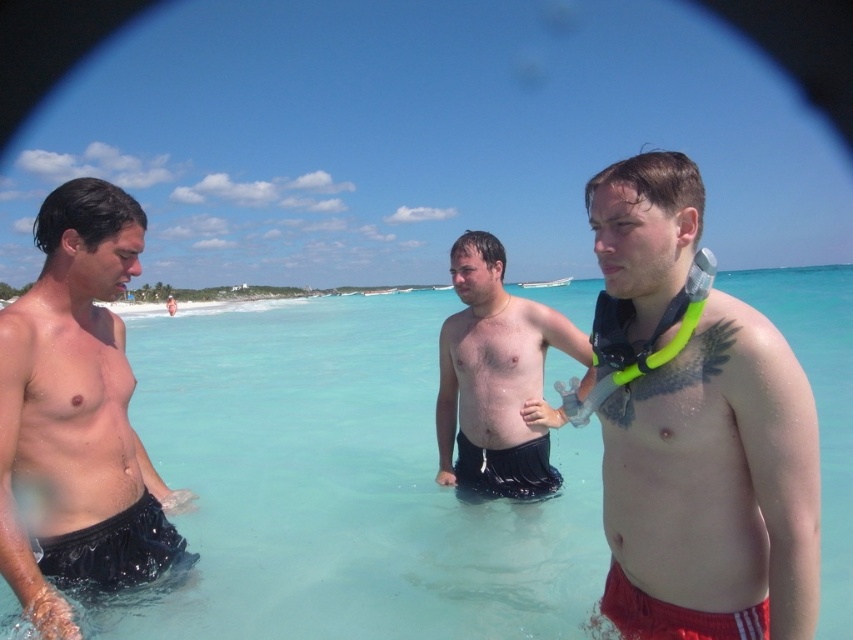
You are a photographer trying to capture a photo of the shiny black shorts at left and the black mesh shorts at lower left. Which one is positioned higher in the image?

The shiny black shorts at left is located above the black mesh shorts at lower left, so it is positioned higher in the image.

You are a photographer trying to capture a photo of both the shiny black shorts at left and the black rubber fins at center. Which object should you focus on first to ensure both are in sharp focus?

You should focus on the shiny black shorts at left first because it is closer to the viewer than the black rubber fins at center, so focusing on the closer object will help ensure both are in focus.

You are a photographer trying to capture the shiny black shorts at left in the image. Where should you focus your camera? Please provide coordinates in the format of point like point 0.653, 0.090

The shiny black shorts at left are located at point (76,417), so you should focus your camera there.